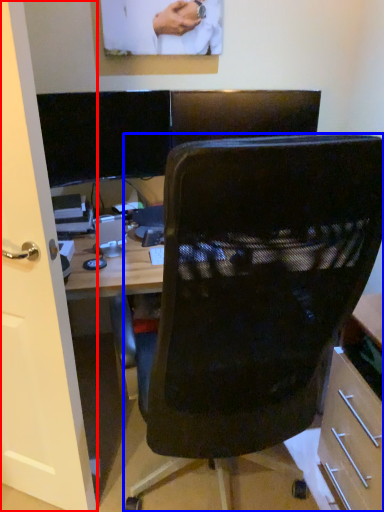
Question: Which object is further to the camera taking this photo, glass door (highlighted by a red box) or chair (highlighted by a blue box)?

Choices:
 (A) glass door
 (B) chair

Answer: (A)